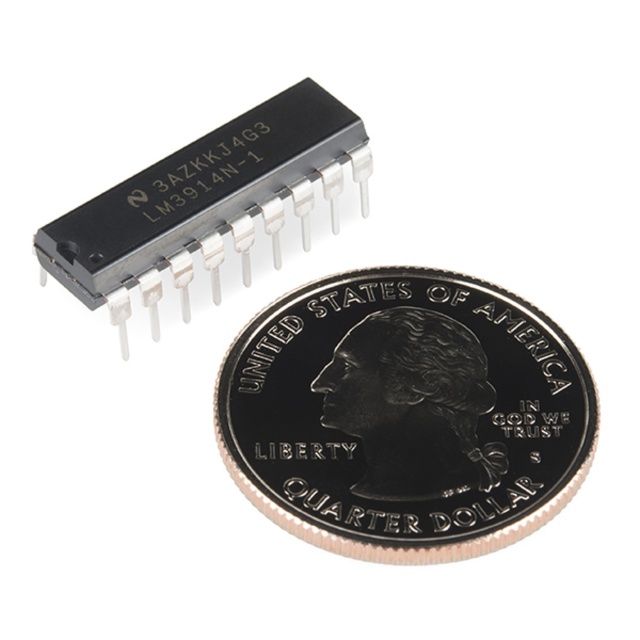
Question: Which object is closer to the camera taking this photo?

Choices:
 (A) silver/glossy/quarter dollar at center
 (B) black plastic ic at upper left

Answer: (A)

Question: Is silver/glossy/quarter dollar at center further to camera compared to black plastic ic at upper left?

Choices:
 (A) yes
 (B) no

Answer: (B)

Question: Is silver/glossy/quarter dollar at center closer to the viewer compared to black plastic ic at upper left?

Choices:
 (A) no
 (B) yes

Answer: (B)

Question: Which point appears closest to the camera in this image?

Choices:
 (A) (260, 330)
 (B) (344, 131)

Answer: (A)

Question: Is silver/glossy/quarter dollar at center bigger than black plastic ic at upper left?

Choices:
 (A) no
 (B) yes

Answer: (B)

Question: Which point is closer to the camera?

Choices:
 (A) (253, 413)
 (B) (285, 141)

Answer: (A)